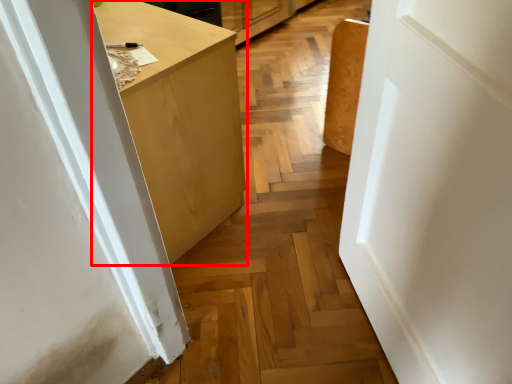
Question: From the image's perspective, where is cabinetry (annotated by the red box) located in relation to door in the image?

Choices:
 (A) above
 (B) below

Answer: (A)